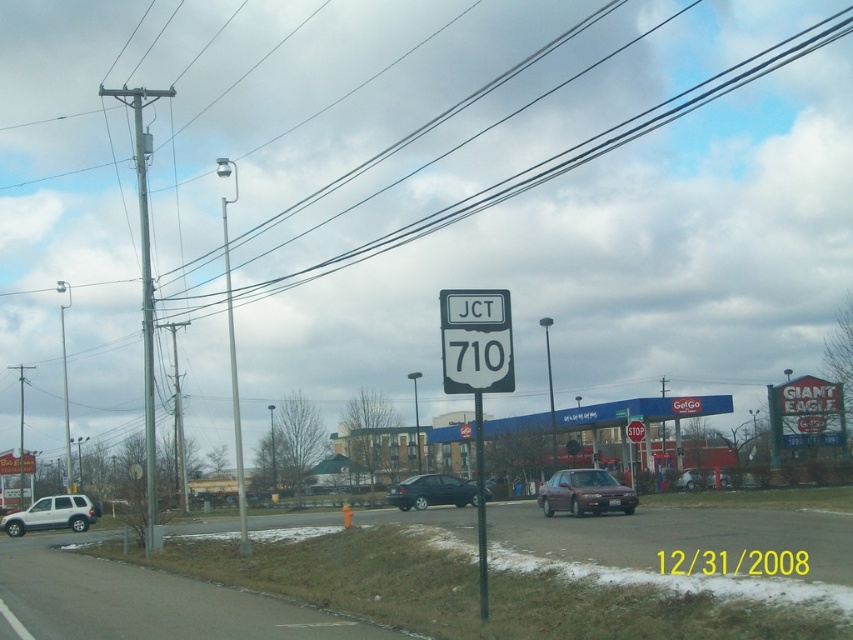
You are a pedestrian standing at the roadside scene near JCT 710. You see a satin silver sedan at center and a shiny black sedan at center. Which sedan is positioned higher in the image?

The satin silver sedan at center is located above the shiny black sedan at center, so it is positioned higher in the image.

From the picture: You are standing at the junction marked by the sign JCT 710 and want to take a photo of both point (482, 461) and point (685, 484). Which point will appear larger in your photo?

Point (482, 461) will appear larger in the photo because it is closer to the camera than point (685, 484).

You are a delivery driver planning to park your truck near the metallic pole at center. The parking spot requires that the truck must not block any overhead wires. Based on the scene, can you safely park there without hitting the black wire at upper center?

The black wire at upper center is located above the metallic pole at center. Since the wire is overhead, parking near the pole might risk hitting the wire. Ensure the truck is parked far enough away from the metallic pole at center to avoid contact with the black wire at upper center.